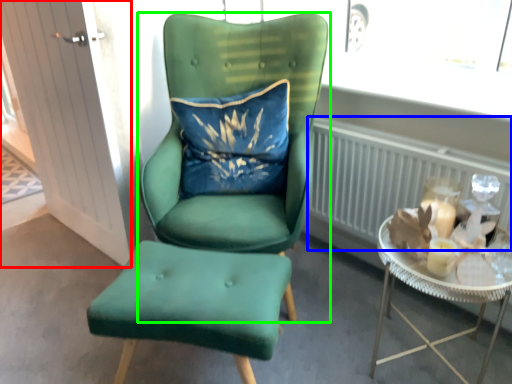
Question: Considering the real-world distances, which object is farthest from glass door (highlighted by a red box)? radiator (highlighted by a blue box) or chair (highlighted by a green box)?

Choices:
 (A) radiator
 (B) chair

Answer: (A)